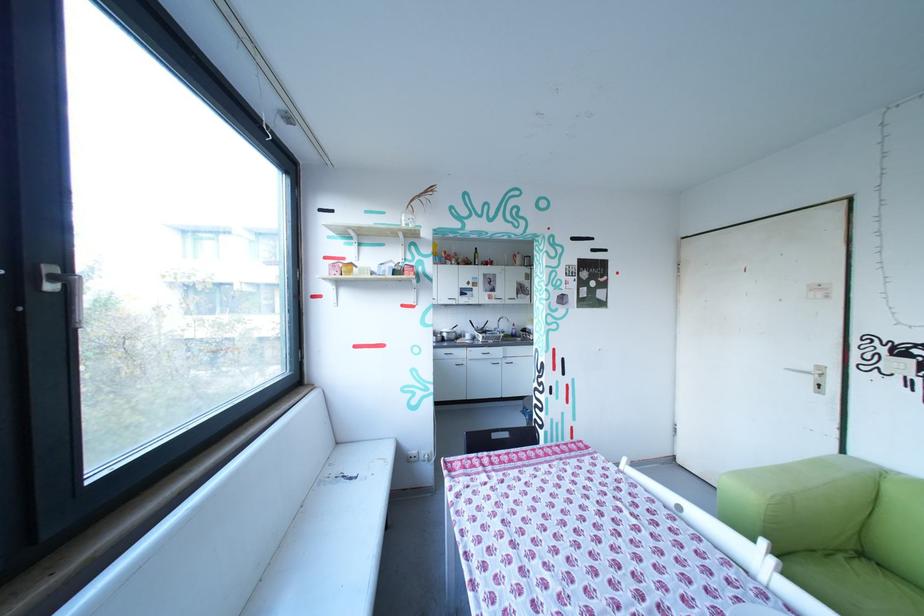
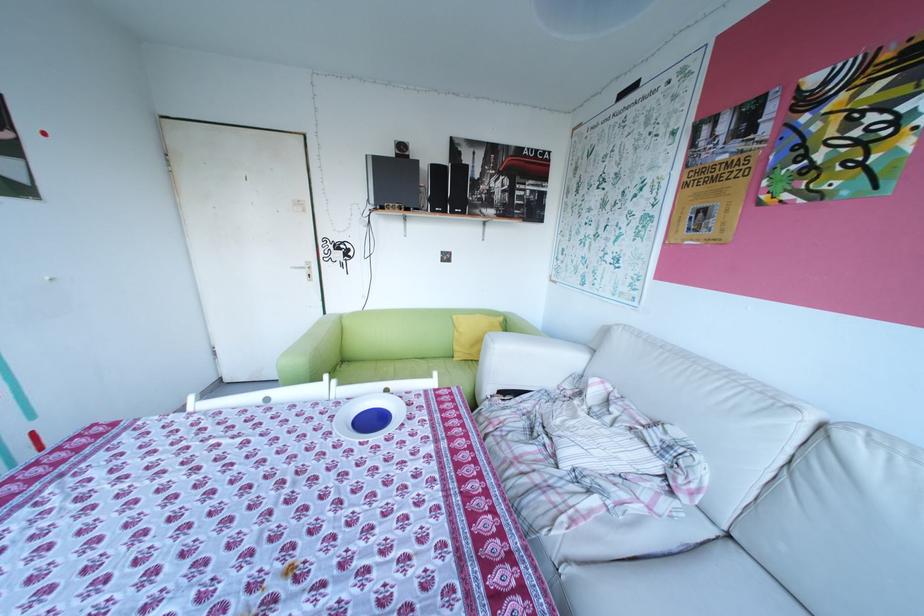
Where in the second image is the point corresponding to pixel 857 452 from the first image?

(337, 313)